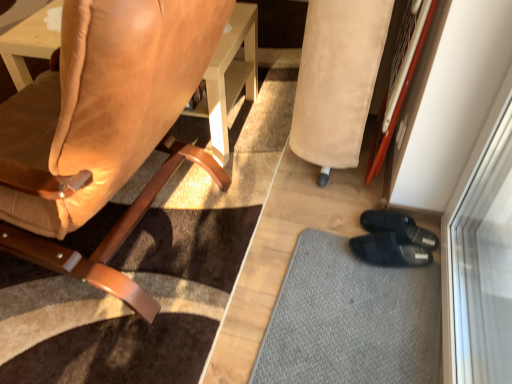
Identify the location of suede leather chair at left. (112, 235).

This screenshot has width=512, height=384. What do you see at coordinates (351, 320) in the screenshot?
I see `gray textured mat at lower right` at bounding box center [351, 320].

This screenshot has height=384, width=512. Identify the location of suede leather chair at left. pyautogui.click(x=112, y=235).

This screenshot has width=512, height=384. Identify the location of bean bag chair on the right side of suede leather chair at left. (337, 79).

Is suede leather chair at left wider than beige suede bean bag chair at lower right?

Indeed, suede leather chair at left has a greater width compared to beige suede bean bag chair at lower right.

From a real-world perspective, is suede leather chair at left over beige suede bean bag chair at lower right?

Yes, from a real-world perspective, suede leather chair at left is above beige suede bean bag chair at lower right.

In the image, is suede leather chair at left on the left side or the right side of beige suede bean bag chair at lower right?

suede leather chair at left is to the left of beige suede bean bag chair at lower right.

Considering the relative sizes of gray textured mat at lower right and beige suede bean bag chair at lower right in the image provided, is gray textured mat at lower right bigger than beige suede bean bag chair at lower right?

Actually, gray textured mat at lower right might be smaller than beige suede bean bag chair at lower right.

Consider the image. From a real-world perspective, is gray textured mat at lower right positioned above or below beige suede bean bag chair at lower right?

gray textured mat at lower right is below beige suede bean bag chair at lower right.

Considering the relative sizes of gray textured mat at lower right and beige suede bean bag chair at lower right in the image provided, is gray textured mat at lower right taller than beige suede bean bag chair at lower right?

No.

Is gray textured mat at lower right oriented towards beige suede bean bag chair at lower right?

No, gray textured mat at lower right is not turned towards beige suede bean bag chair at lower right.

Is gray textured mat at lower right aimed at suede leather chair at left?

No, gray textured mat at lower right is not oriented towards suede leather chair at left.

Does gray textured mat at lower right lie behind suede leather chair at left?

Yes, the depth of gray textured mat at lower right is greater than that of suede leather chair at left.

From the image's perspective, is gray textured mat at lower right located above or below suede leather chair at left?

Clearly, from the image's perspective, gray textured mat at lower right is below suede leather chair at left.

Is beige suede bean bag chair at lower right taller or shorter than suede leather chair at left?

Clearly, beige suede bean bag chair at lower right is shorter compared to suede leather chair at left.

From a real-world perspective, relative to suede leather chair at left, is beige suede bean bag chair at lower right vertically above or below?

From a real-world perspective, beige suede bean bag chair at lower right is physically below suede leather chair at left.

Looking at this image, from the image's perspective, is beige suede bean bag chair at lower right above or below suede leather chair at left?

Clearly, from the image's perspective, beige suede bean bag chair at lower right is above suede leather chair at left.

Can you see beige suede bean bag chair at lower right touching suede leather chair at left?

beige suede bean bag chair at lower right is not next to suede leather chair at left, and they're not touching.

Would you say suede leather chair at left is outside gray textured mat at lower right?

Yes.

Locate an element on the screen. The height and width of the screenshot is (384, 512). chair lying above the gray textured mat at lower right (from the image's perspective) is located at coordinates (112, 235).

In the image, is suede leather chair at left positioned in front of or behind gray textured mat at lower right?

suede leather chair at left is positioned closer to the viewer than gray textured mat at lower right.

Is suede leather chair at left to the right of gray textured mat at lower right from the viewer's perspective?

No, suede leather chair at left is not to the right of gray textured mat at lower right.

Is beige suede bean bag chair at lower right to the left or to the right of gray textured mat at lower right in the image?

Clearly, beige suede bean bag chair at lower right is on the right of gray textured mat at lower right in the image.

From a real-world perspective, is beige suede bean bag chair at lower right positioned above or below gray textured mat at lower right?

From a real-world perspective, beige suede bean bag chair at lower right is physically above gray textured mat at lower right.

Identify the location of doormat that is on the left side of beige suede bean bag chair at lower right. (351, 320).

Based on the photo, is the depth of beige suede bean bag chair at lower right greater than that of gray textured mat at lower right?

No, it is in front of gray textured mat at lower right.

The width and height of the screenshot is (512, 384). Identify the location of chair above the beige suede bean bag chair at lower right (from a real-world perspective). (112, 235).

This screenshot has width=512, height=384. Find the location of `doormat behind the beige suede bean bag chair at lower right`. doormat behind the beige suede bean bag chair at lower right is located at coordinates (351, 320).

Estimate the real-world distances between objects in this image. Which object is further from suede leather chair at left, beige suede bean bag chair at lower right or gray textured mat at lower right?

Based on the image, gray textured mat at lower right appears to be further to suede leather chair at left.

When comparing their distances from beige suede bean bag chair at lower right, does gray textured mat at lower right or suede leather chair at left seem closer?

suede leather chair at left is positioned closer to the anchor beige suede bean bag chair at lower right.

From the image, which object appears to be nearer to beige suede bean bag chair at lower right, suede leather chair at left or gray textured mat at lower right?

Among the two, suede leather chair at left is located nearer to beige suede bean bag chair at lower right.

When comparing their distances from suede leather chair at left, does gray textured mat at lower right or beige suede bean bag chair at lower right seem further?

gray textured mat at lower right is further to suede leather chair at left.

When comparing their distances from gray textured mat at lower right, does beige suede bean bag chair at lower right or suede leather chair at left seem further?

Based on the image, suede leather chair at left appears to be further to gray textured mat at lower right.

Estimate the real-world distances between objects in this image. Which object is closer to gray textured mat at lower right, suede leather chair at left or beige suede bean bag chair at lower right?

Among the two, beige suede bean bag chair at lower right is located nearer to gray textured mat at lower right.

At what (x,y) coordinates should I click in order to perform the action: click on doormat between suede leather chair at left and beige suede bean bag chair at lower right in the horizontal direction. Please return your answer as a coordinate pair (x, y). Image resolution: width=512 pixels, height=384 pixels. Looking at the image, I should click on (351, 320).